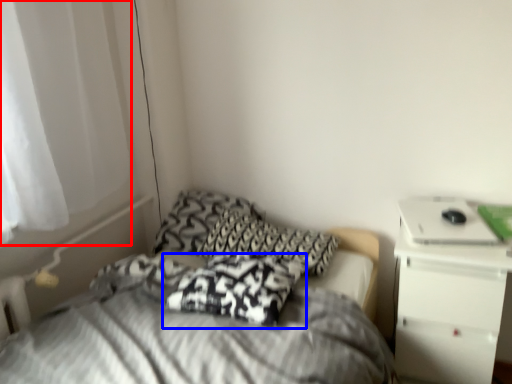
Question: Which of the following is the closest to the observer, curtain (highlighted by a red box) or pillow (highlighted by a blue box)?

Choices:
 (A) curtain
 (B) pillow

Answer: (A)